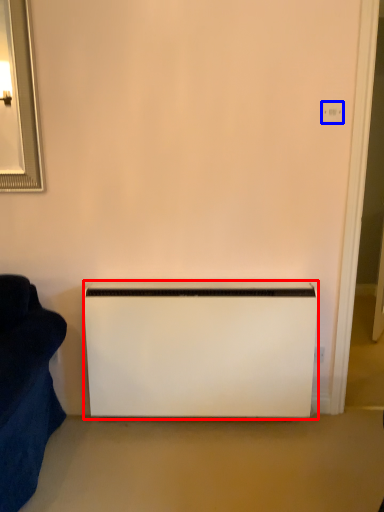
Question: Among these objects, which one is farthest to the camera, appliance (highlighted by a red box) or electric outlet (highlighted by a blue box)?

Choices:
 (A) appliance
 (B) electric outlet

Answer: (A)